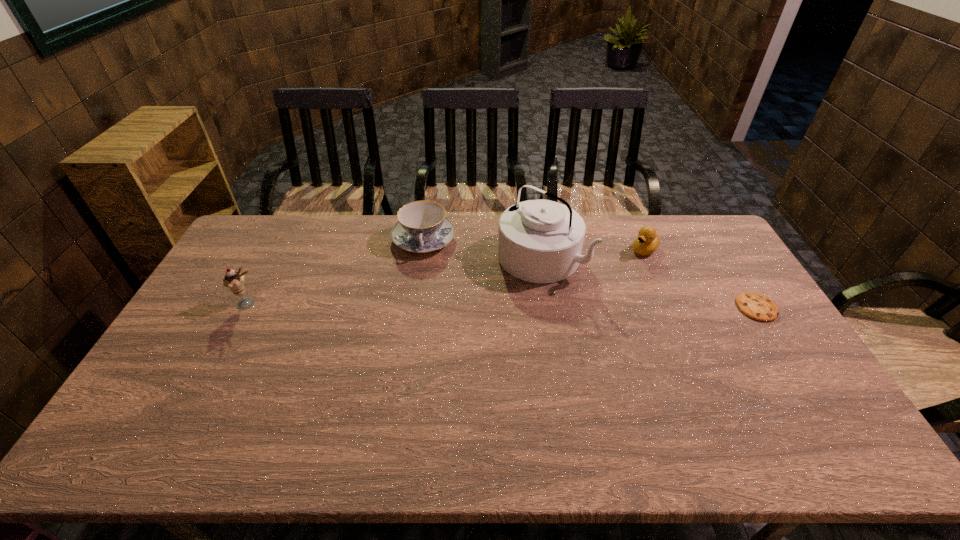
Locate an element on the screen. free space that is in between the shortest object and the duckling is located at coordinates (701, 279).

Image resolution: width=960 pixels, height=540 pixels. I want to click on free area in between the shortest object and the kettle, so click(x=649, y=282).

You are a GUI agent. You are given a task and a screenshot of the screen. Output one action in this format:
    pyautogui.click(x=<x>, y=<y>)
    Task: Click on the free area in between the second tallest object and the shortest object
    
    Given the screenshot: What is the action you would take?
    pyautogui.click(x=503, y=306)

Where is `free spot between the icecream and the kettle`? This screenshot has width=960, height=540. free spot between the icecream and the kettle is located at coordinates (396, 280).

What are the coordinates of `unoccupied position between the duckling and the shortest object` in the screenshot? It's located at (701, 279).

Image resolution: width=960 pixels, height=540 pixels. Find the location of `unoccupied area between the leftmost object and the chinaware`. unoccupied area between the leftmost object and the chinaware is located at coordinates (336, 272).

Identify the location of vacant area between the second object from left to right and the kettle. (483, 248).

Find the location of `free space that is in between the kettle and the leftmost object`. free space that is in between the kettle and the leftmost object is located at coordinates (396, 280).

At what (x,y) coordinates should I click in order to perform the action: click on blank region between the second object from right to left and the leftmost object. Please return your answer as a coordinate pair (x, y). Looking at the image, I should click on (446, 276).

Find the location of a particular element. object that ranks as the third closest to the icecream is located at coordinates (648, 240).